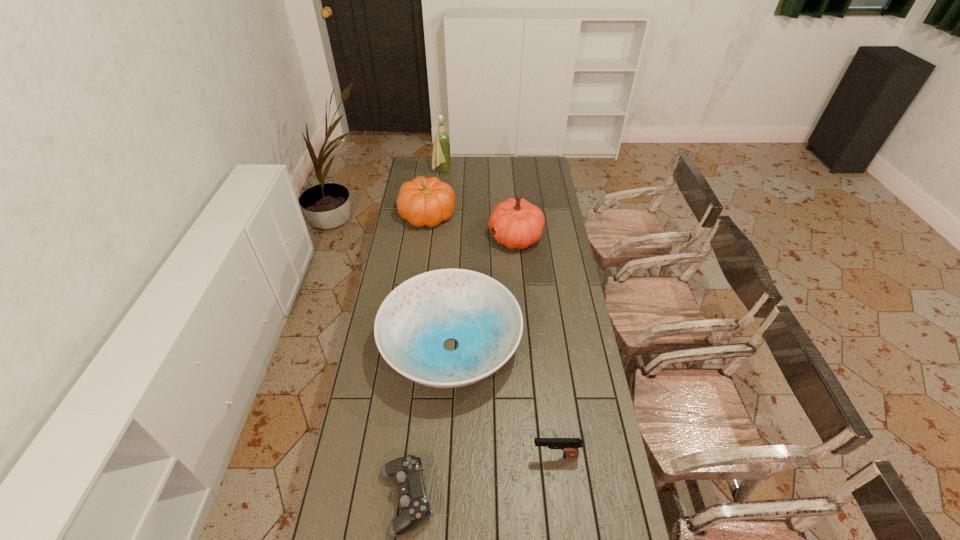
Identify the location of vacant space that satisfies the following two spatial constraints: 1. on the front-facing side of the tallest object; 2. on the front side of the left pumpkin. This screenshot has height=540, width=960. (437, 215).

Image resolution: width=960 pixels, height=540 pixels. I want to click on free spot that satisfies the following two spatial constraints: 1. on the front-facing side of the fourth tallest object; 2. on the left side of the tallest object, so (421, 346).